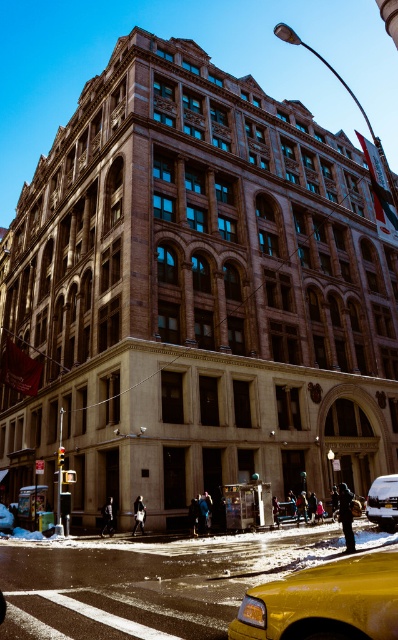
Question: Considering the real-world distances, which object is farthest from the yellow plastic taxi at center?

Choices:
 (A) silver metallic van at center
 (B) yellow matte taxi at lower right

Answer: (A)

Question: Can you confirm if yellow plastic taxi at center is bigger than yellow matte taxi at lower right?

Choices:
 (A) no
 (B) yes

Answer: (B)

Question: Can you confirm if yellow plastic taxi at center is wider than silver metallic van at center?

Choices:
 (A) yes
 (B) no

Answer: (A)

Question: Is yellow plastic taxi at center thinner than silver metallic van at center?

Choices:
 (A) yes
 (B) no

Answer: (B)

Question: Which of these objects is positioned closest to the silver metallic van at center?

Choices:
 (A) yellow matte taxi at lower right
 (B) yellow plastic taxi at center

Answer: (B)

Question: Which is nearer to the silver metallic van at center?

Choices:
 (A) yellow plastic taxi at center
 (B) yellow matte taxi at lower right

Answer: (A)